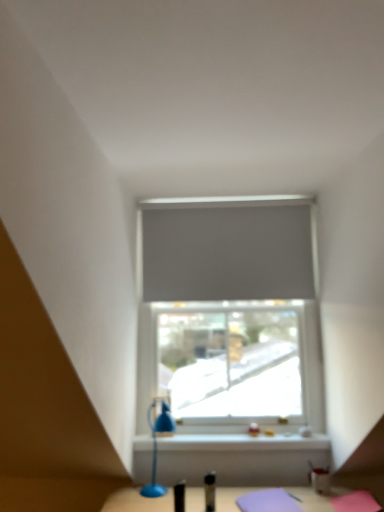
Question: Can you confirm if blue plastic table lamp at lower center is wider than matte gray roller blind at center?

Choices:
 (A) yes
 (B) no

Answer: (A)

Question: Is blue plastic table lamp at lower center further to camera compared to matte gray roller blind at center?

Choices:
 (A) no
 (B) yes

Answer: (A)

Question: Is blue plastic table lamp at lower center facing towards matte gray roller blind at center?

Choices:
 (A) no
 (B) yes

Answer: (A)

Question: Does blue plastic table lamp at lower center have a lesser height compared to matte gray roller blind at center?

Choices:
 (A) yes
 (B) no

Answer: (A)

Question: Is blue plastic table lamp at lower center in front of matte gray roller blind at center?

Choices:
 (A) yes
 (B) no

Answer: (A)

Question: From a real-world perspective, is blue plastic table lamp at lower center located higher than matte gray roller blind at center?

Choices:
 (A) no
 (B) yes

Answer: (A)

Question: Is blue plastic table lamp at lower center completely or partially inside gray matte curtain at center?

Choices:
 (A) yes
 (B) no

Answer: (B)

Question: Can you confirm if gray matte curtain at center is positioned to the right of blue plastic table lamp at lower center?

Choices:
 (A) no
 (B) yes

Answer: (B)

Question: Is gray matte curtain at center smaller than blue plastic table lamp at lower center?

Choices:
 (A) yes
 (B) no

Answer: (B)

Question: From a real-world perspective, is gray matte curtain at center under blue plastic table lamp at lower center?

Choices:
 (A) yes
 (B) no

Answer: (B)

Question: From a real-world perspective, is gray matte curtain at center on top of blue plastic table lamp at lower center?

Choices:
 (A) yes
 (B) no

Answer: (A)

Question: Would you consider gray matte curtain at center to be distant from blue plastic table lamp at lower center?

Choices:
 (A) yes
 (B) no

Answer: (B)

Question: Is matte gray roller blind at center at the left side of gray matte curtain at center?

Choices:
 (A) no
 (B) yes

Answer: (B)